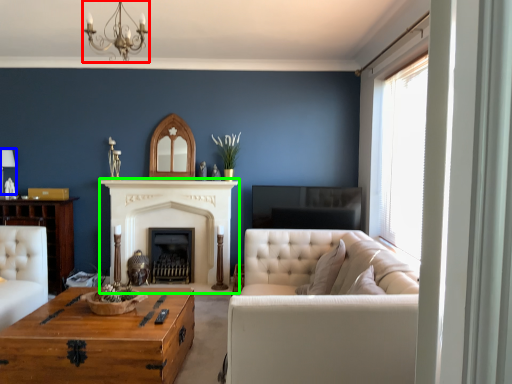
Question: Estimate the real-world distances between objects in this image. Which object is farther from light fixture (highlighted by a red box), lamp (highlighted by a blue box) or fireplace (highlighted by a green box)?

Choices:
 (A) lamp
 (B) fireplace

Answer: (B)